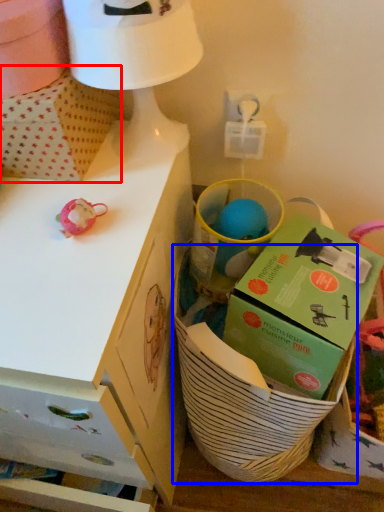
Question: Which of the following is the closest to the observer, cardboard box (highlighted by a red box) or basket (highlighted by a blue box)?

Choices:
 (A) cardboard box
 (B) basket

Answer: (B)